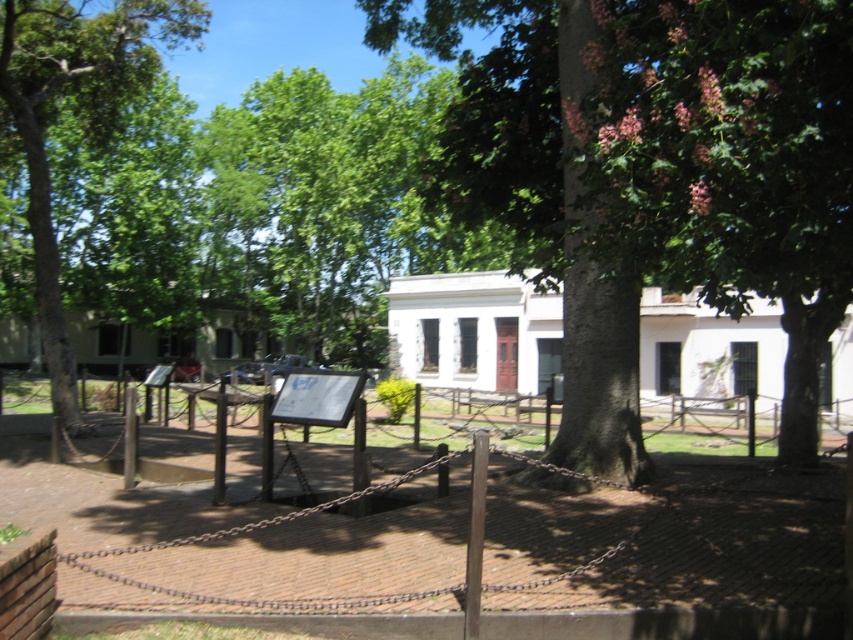
Is the position of wooden fence at center less distant than that of green leafy tree at left?

Yes, it is.

Who is positioned more to the right, wooden fence at center or green leafy tree at left?

From the viewer's perspective, wooden fence at center appears more on the right side.

Which is in front, point (79, 580) or point (76, 49)?

Point (79, 580)

This screenshot has width=853, height=640. In order to click on wooden fence at center in this screenshot , I will do `click(670, 563)`.

Where is `green textured bark at center`? green textured bark at center is located at coordinates (657, 173).

Is green textured bark at center in front of green leafy tree at left?

Yes, it is.

Who is more forward, (723, 173) or (113, 29)?

Point (723, 173) is in front.

Identify the location of green textured bark at center. The height and width of the screenshot is (640, 853). (657, 173).

Can you confirm if green textured bark at center is positioned below wooden fence at center?

Actually, green textured bark at center is above wooden fence at center.

Locate an element on the screen. This screenshot has height=640, width=853. green textured bark at center is located at coordinates (657, 173).

The height and width of the screenshot is (640, 853). Describe the element at coordinates (657, 173) in the screenshot. I see `green textured bark at center` at that location.

The height and width of the screenshot is (640, 853). I want to click on green textured bark at center, so click(x=657, y=173).